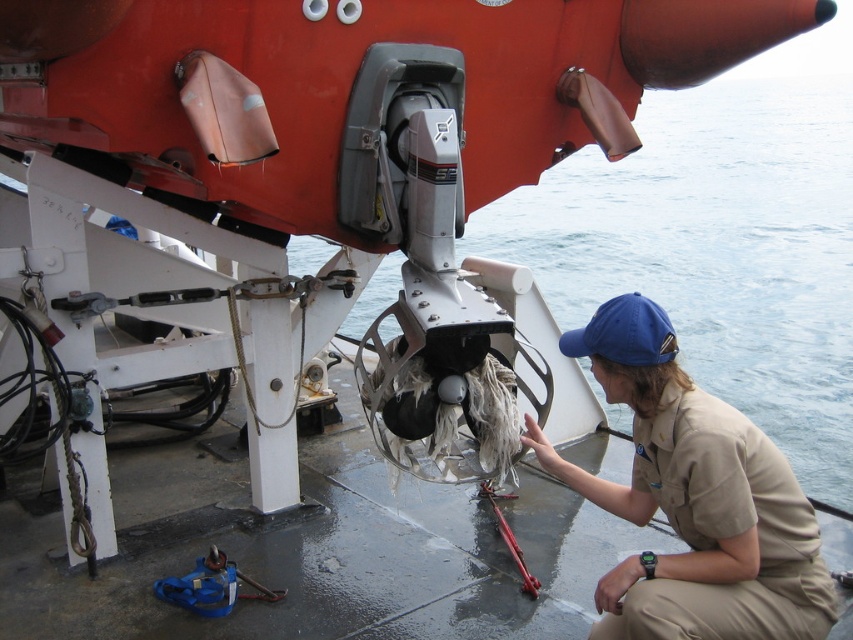
Question: Where is khaki uniform at lower right located in relation to blue fabric baseball cap at center in the image?

Choices:
 (A) above
 (B) below

Answer: (B)

Question: Which point appears closest to the camera in this image?

Choices:
 (A) (653, 339)
 (B) (619, 321)

Answer: (A)

Question: Does khaki uniform at lower right have a greater width compared to blue fabric baseball cap at center?

Choices:
 (A) yes
 (B) no

Answer: (A)

Question: From the image, what is the correct spatial relationship of khaki uniform at lower right in relation to blue fabric baseball cap at center?

Choices:
 (A) right
 (B) left

Answer: (A)